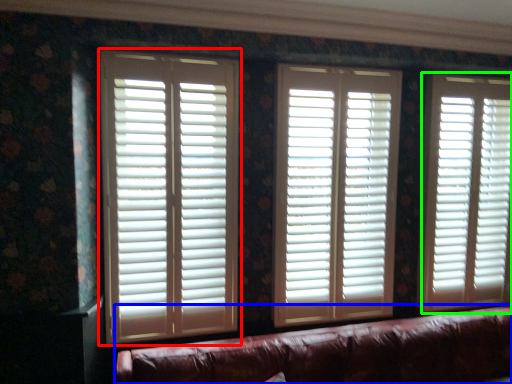
Question: Which object is the farthest from window blind (highlighted by a red box)? Choose among these: studio couch (highlighted by a blue box) or window blind (highlighted by a green box).

Choices:
 (A) studio couch
 (B) window blind

Answer: (B)